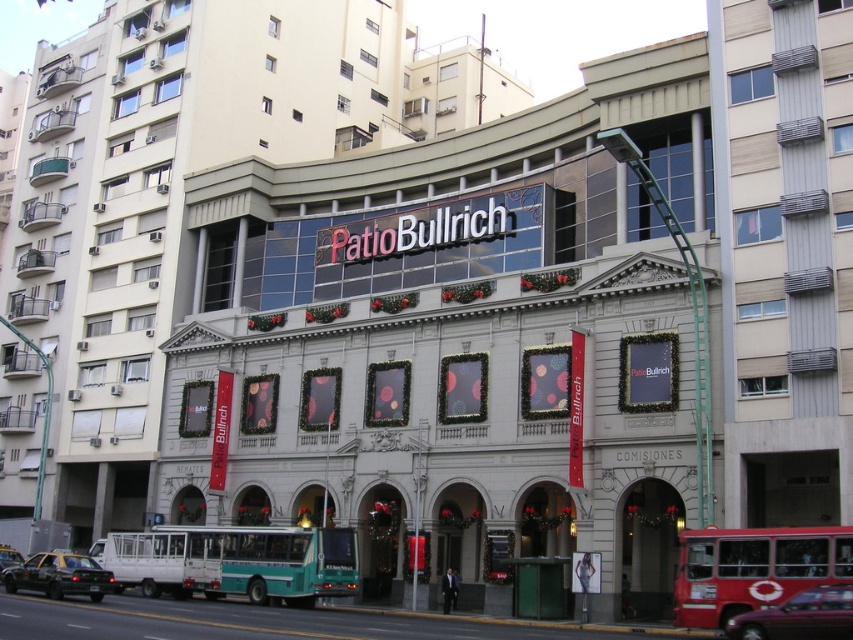
You are a delivery person trying to enter the Patio Bullrich building with a 2.2 meters tall package. The entrance is between the teal matte bus at lower center and the black glossy car at lower left. Can the package fit through the entrance?

The teal matte bus at lower center is taller than the black glossy car at lower left. Since the entrance is between them, the height of the entrance would be determined by the shorter object, which is the black glossy car at lower left. If the car is shorter than 2.2 meters, the package may not fit. However, without specific height measurements for the car, it is uncertain. The answer cannot be definitively determined with the given information.

You are a delivery person who needs to park your 5 meter long truck between the red rubber bus at lower right and the black glossy car at lower left. Is there enough space between them for your truck?

The red rubber bus at lower right and the black glossy car at lower left are 37.87 meters apart from each other. Since your truck is only 5 meters long, there is more than enough space to park between them.

You are a delivery person trying to park your van in the parking lot behind the Patio Bullrich building. There are two cars blocking the entrance to the parking area. The cars are a black rubber car at lower left and a black glossy car at lower left. Which car should you move first to access the parking lot?

The black rubber car at lower left is in front of the black glossy car at lower left, so you should move the black rubber car at lower left first to access the parking lot.